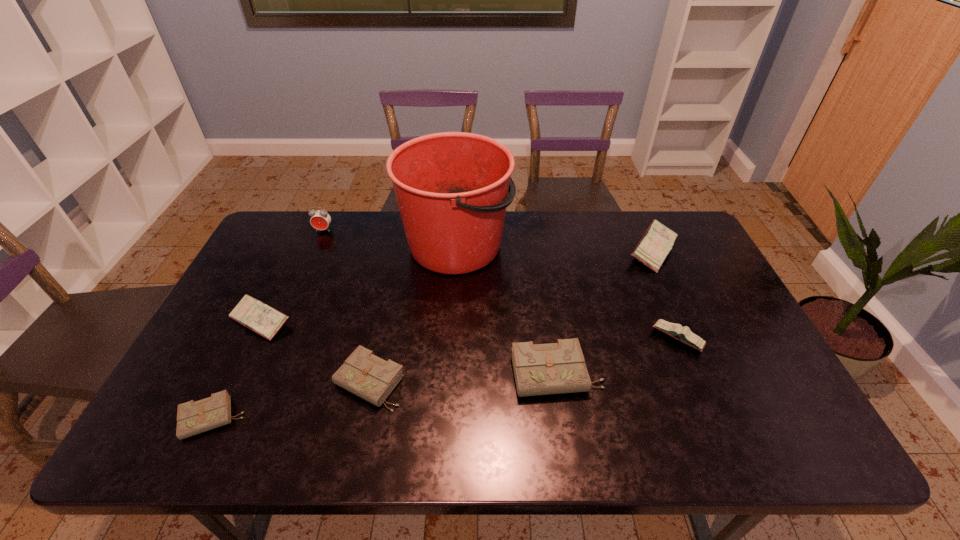
I want to click on the second biggest green diary, so click(371, 378).

Where is `the smallest pink diary`? the smallest pink diary is located at coordinates (684, 334).

This screenshot has height=540, width=960. In order to click on the shortest diary in this screenshot , I will do `click(194, 417)`.

I want to click on the smallest green diary, so click(x=194, y=417).

Locate an element on the screen. free space located 0.320m on the left of the pink bucket is located at coordinates (303, 245).

Locate an element on the screen. Image resolution: width=960 pixels, height=540 pixels. free spot located 0.090m on the face of the alarm clock is located at coordinates (315, 250).

Image resolution: width=960 pixels, height=540 pixels. In order to click on vacant area located on the back of the farthest pink diary in this screenshot , I will do pyautogui.click(x=638, y=217).

You are a GUI agent. You are given a task and a screenshot of the screen. Output one action in this format:
    pyautogui.click(x=<x>, y=<y>)
    Task: Click on the blank space located on the left of the fourth diary from left to right
    Image resolution: width=960 pixels, height=540 pixels.
    Given the screenshot: What is the action you would take?
    pyautogui.click(x=471, y=374)

You are a GUI agent. You are given a task and a screenshot of the screen. Output one action in this format:
    pyautogui.click(x=<x>, y=<y>)
    Task: Click on the vacant space located on the back of the leftmost pink diary
    This screenshot has width=960, height=540.
    Given the screenshot: What is the action you would take?
    pyautogui.click(x=309, y=220)

Locate an element on the screen. This screenshot has height=540, width=960. vacant space located 0.070m on the left of the fourth diary from right to left is located at coordinates (306, 382).